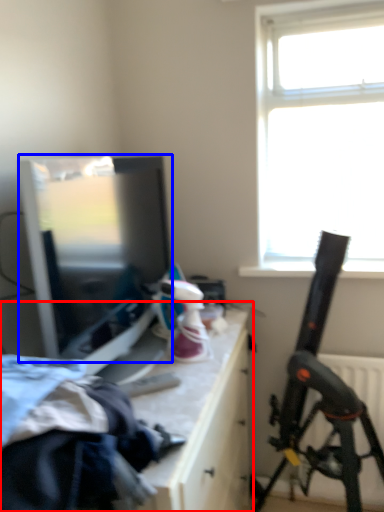
Question: Among these objects, which one is farthest to the camera, table (highlighted by a red box) or window screen (highlighted by a blue box)?

Choices:
 (A) table
 (B) window screen

Answer: (B)